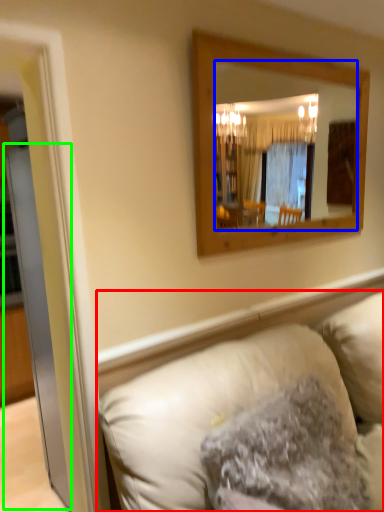
Question: Considering the real-world distances, which object is farthest from studio couch (highlighted by a red box)? mirror (highlighted by a blue box) or glass door (highlighted by a green box)?

Choices:
 (A) mirror
 (B) glass door

Answer: (A)